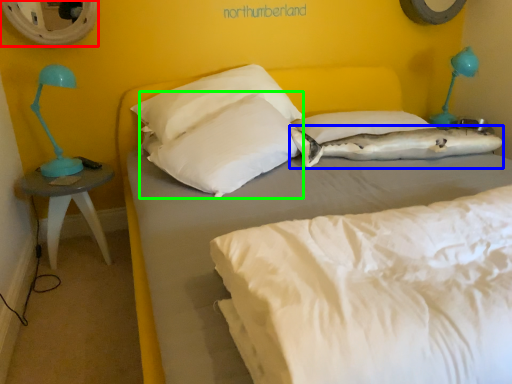
Question: Which object is positioned closest to mirror (highlighted by a red box)? Select from pillow (highlighted by a blue box) and pillow (highlighted by a green box).

Choices:
 (A) pillow
 (B) pillow

Answer: (B)